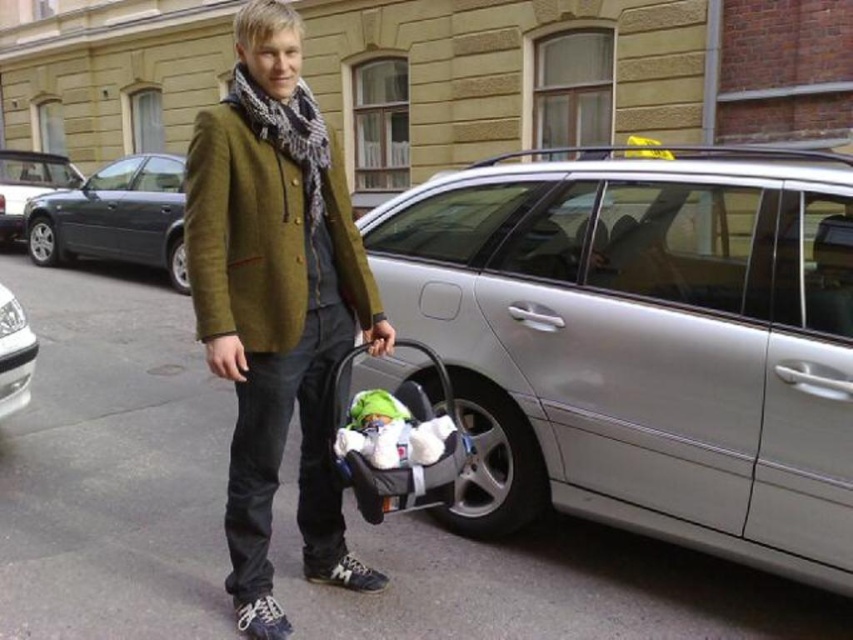
Question: Among these objects, which one is nearest to the camera?

Choices:
 (A) matte green jacket at center
 (B) silver metallic car at right
 (C) silver metallic car at left
 (D) white glossy car at left

Answer: (A)

Question: Does silver metallic car at right appear on the left side of soft fabric baby carriage at lower center?

Choices:
 (A) yes
 (B) no

Answer: (B)

Question: Which of the following is the closest to the observer?

Choices:
 (A) metallic gray sedan at left
 (B) white plush toy at center

Answer: (B)

Question: Is soft fabric baby carriage at lower center positioned in front of white glossy car at left?

Choices:
 (A) yes
 (B) no

Answer: (A)

Question: Which point is closer to the camera?

Choices:
 (A) (412, 381)
 (B) (698, 401)
 (C) (450, 476)
 (D) (3, 385)

Answer: (C)

Question: Does matte green jacket at center appear on the right side of metallic gray sedan at left?

Choices:
 (A) no
 (B) yes

Answer: (B)